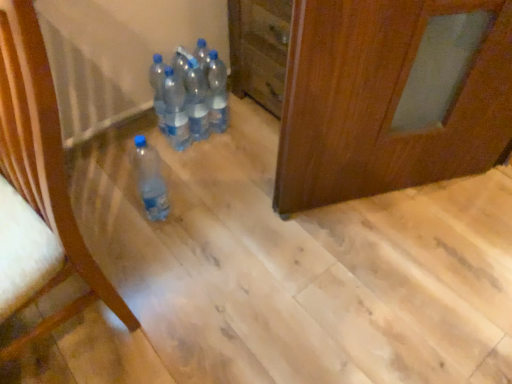
Where is `free space between translucent plastic bottle at lower left, marked as the 2th bottle in a left-to-right arrangement, and translucent plastic bottles at center, placed as the fourth bottle when sorted from left to right`? This screenshot has height=384, width=512. free space between translucent plastic bottle at lower left, marked as the 2th bottle in a left-to-right arrangement, and translucent plastic bottles at center, placed as the fourth bottle when sorted from left to right is located at coordinates (182, 172).